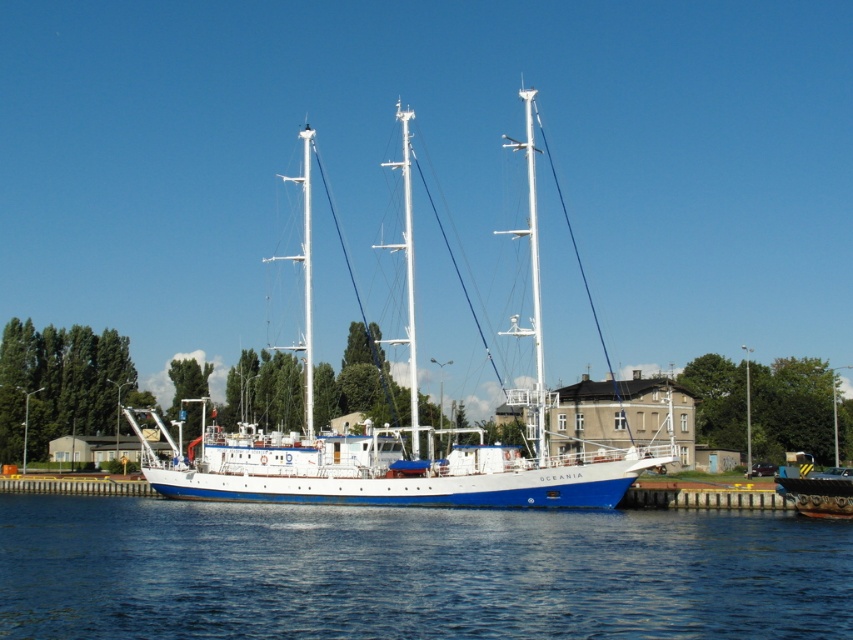
Is white matte sailboat at center thinner than blue matte boat at lower right?

Incorrect, white matte sailboat at center's width is not less than blue matte boat at lower right's.

Is point (567, 486) positioned after point (786, 484)?

No, (567, 486) is in front of (786, 484).

This screenshot has width=853, height=640. What do you see at coordinates (410, 451) in the screenshot? I see `white matte sailboat at center` at bounding box center [410, 451].

I want to click on white matte sailboat at center, so click(410, 451).

Does blue water at lower center have a larger size compared to white matte sailboat at center?

Incorrect, blue water at lower center is not larger than white matte sailboat at center.

Is blue water at lower center above white matte sailboat at center?

Incorrect, blue water at lower center is not positioned above white matte sailboat at center.

Is point (120, 624) closer to camera compared to point (281, 440)?

Yes, point (120, 624) is in front of point (281, 440).

At what (x,y) coordinates should I click in order to perform the action: click on blue water at lower center. Please return your answer as a coordinate pair (x, y). Image resolution: width=853 pixels, height=640 pixels. Looking at the image, I should click on (413, 572).

Does blue water at lower center appear on the left side of blue matte boat at lower right?

Indeed, blue water at lower center is positioned on the left side of blue matte boat at lower right.

Is blue water at lower center above blue matte boat at lower right?

Correct, blue water at lower center is located above blue matte boat at lower right.

What are the coordinates of `blue water at lower center` in the screenshot? It's located at (413, 572).

You are a GUI agent. You are given a task and a screenshot of the screen. Output one action in this format:
    pyautogui.click(x=<x>, y=<y>)
    Task: Click on the blue water at lower center
    Image resolution: width=853 pixels, height=640 pixels.
    Given the screenshot: What is the action you would take?
    pyautogui.click(x=413, y=572)